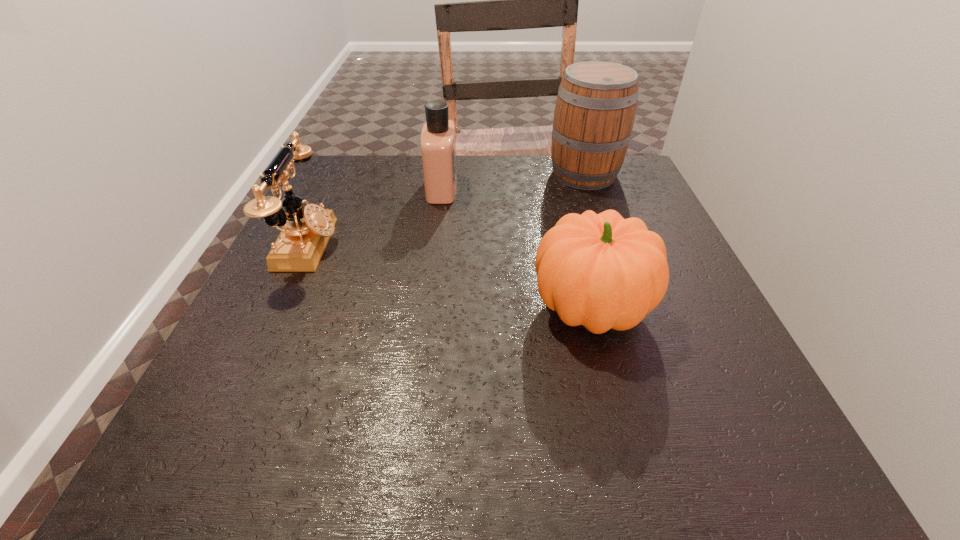
Image resolution: width=960 pixels, height=540 pixels. In the image, there is a desktop. Find the location of `vacant space at the far right corner`. vacant space at the far right corner is located at coordinates (625, 204).

Image resolution: width=960 pixels, height=540 pixels. What are the coordinates of `vacant space at the near right corner of the desktop` in the screenshot? It's located at point(746,475).

The image size is (960, 540). I want to click on vacant area that lies between the perfume and the telephone, so click(375, 217).

The width and height of the screenshot is (960, 540). Find the location of `free space between the pumpkin and the perfume`. free space between the pumpkin and the perfume is located at coordinates (516, 248).

The height and width of the screenshot is (540, 960). I want to click on empty location between the telephone and the perfume, so [375, 217].

Locate an element on the screen. The image size is (960, 540). vacant area between the leftmost object and the pumpkin is located at coordinates (450, 276).

Locate an element on the screen. The width and height of the screenshot is (960, 540). free space that is in between the pumpkin and the perfume is located at coordinates (516, 248).

Where is `free spot between the cider and the telephone`? This screenshot has width=960, height=540. free spot between the cider and the telephone is located at coordinates [x=446, y=210].

At what (x,y) coordinates should I click in order to perform the action: click on free point between the pumpkin and the perfume. Please return your answer as a coordinate pair (x, y). This screenshot has height=540, width=960. Looking at the image, I should click on (516, 248).

Find the location of a particular element. Image resolution: width=960 pixels, height=540 pixels. free space between the second object from left to right and the pumpkin is located at coordinates [516, 248].